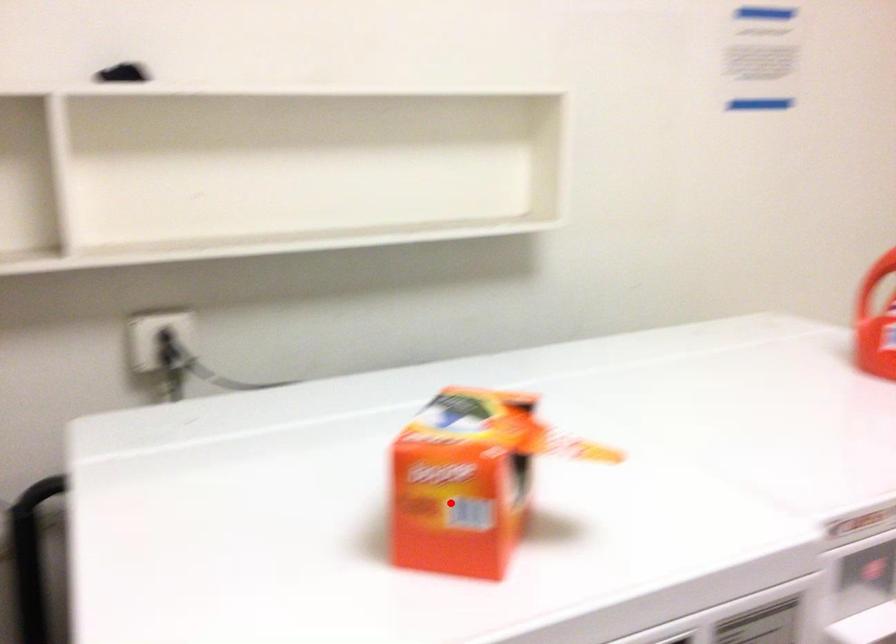
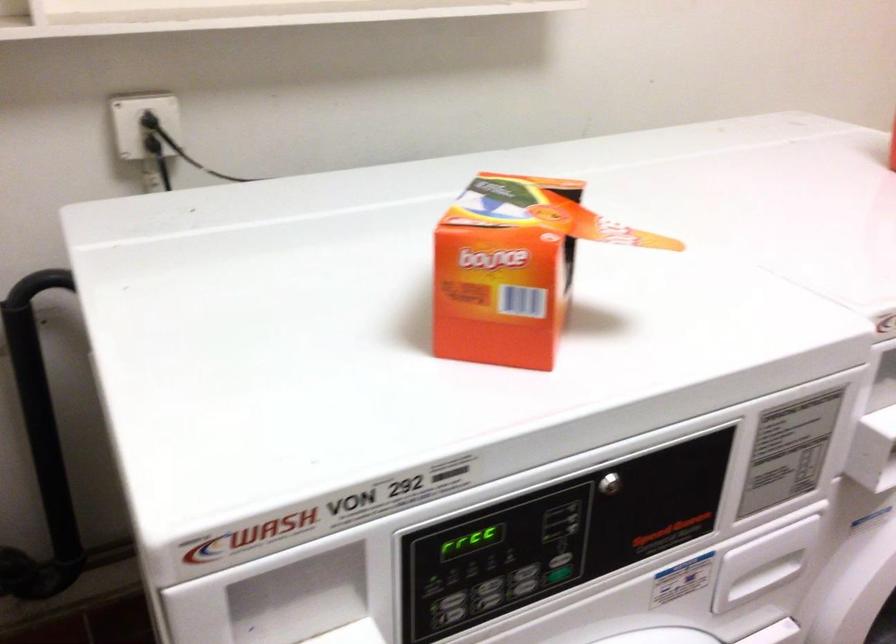
Where in the second image is the point corresponding to the highlighted location from the first image?

(502, 287)